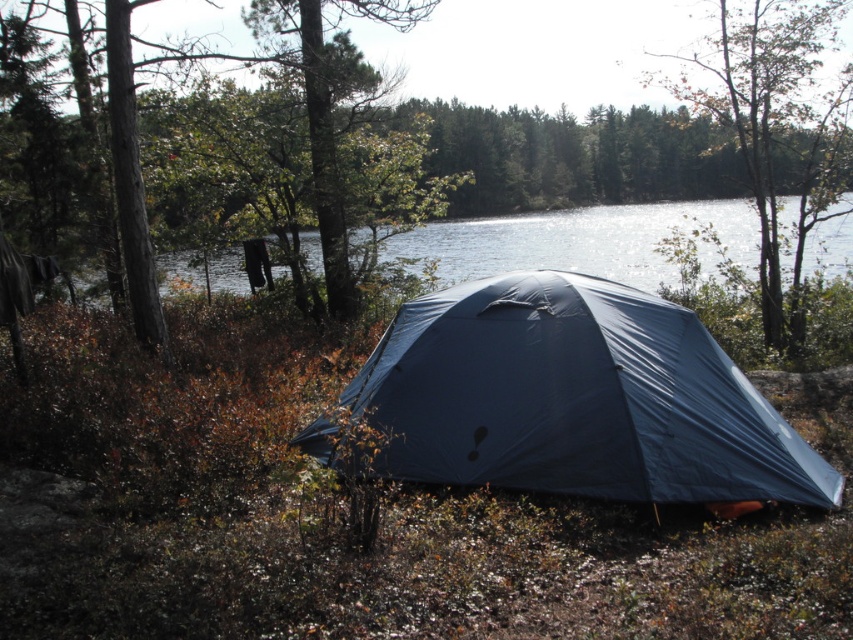
Can you confirm if green leafy tree at upper center is smaller than transparent blue water at center?

Incorrect, green leafy tree at upper center is not smaller in size than transparent blue water at center.

Is point (747, 67) farther from camera compared to point (578, 272)?

No, it is in front of (578, 272).

I want to click on green leafy tree at upper center, so click(x=776, y=125).

Is green leafy tree at upper center positioned at the back of green matte tree at upper left?

No.

Is green leafy tree at upper center in front of green matte tree at upper left?

Yes, it is in front of green matte tree at upper left.

Is point (759, 77) farther from viewer compared to point (256, 19)?

No.

Where is `green leafy tree at upper center`? Image resolution: width=853 pixels, height=640 pixels. green leafy tree at upper center is located at coordinates (776, 125).

Which is below, brown wood tree at center or green matte tree at upper left?

brown wood tree at center is below.

In the scene shown: Does brown wood tree at center appear under green matte tree at upper left?

Yes, brown wood tree at center is below green matte tree at upper left.

Locate an element on the screen. The image size is (853, 640). brown wood tree at center is located at coordinates (576, 156).